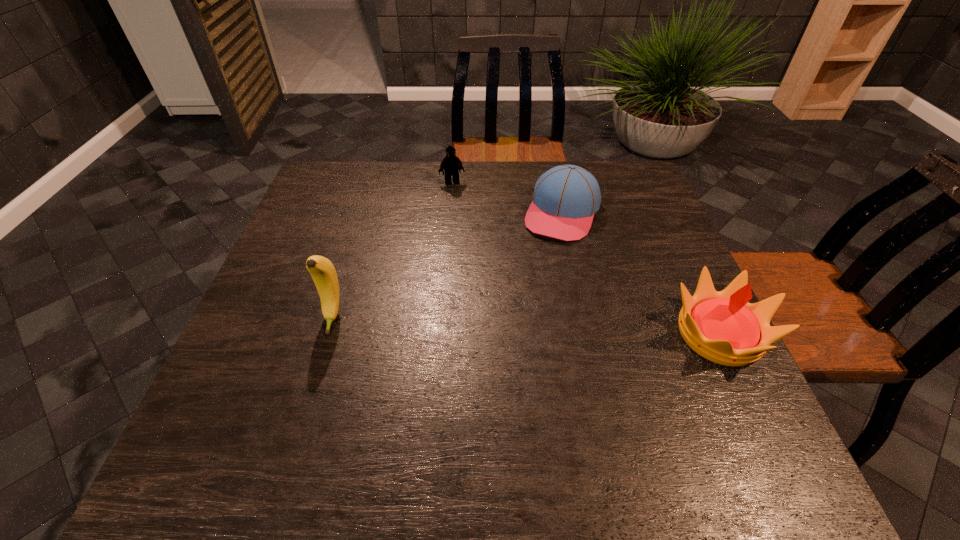
This screenshot has height=540, width=960. What are the coordinates of `free space at the left edge of the desktop` in the screenshot? It's located at (300, 267).

The height and width of the screenshot is (540, 960). Find the location of `vacant space at the right edge`. vacant space at the right edge is located at coordinates (632, 294).

In the image, there is a desktop. Where is `vacant space at the far left corner`? This screenshot has height=540, width=960. vacant space at the far left corner is located at coordinates (353, 196).

In the image, there is a desktop. Identify the location of free space at the far right corner. (649, 192).

Where is `free space between the banana and the second object from right to left`? free space between the banana and the second object from right to left is located at coordinates (447, 266).

You are a GUI agent. You are given a task and a screenshot of the screen. Output one action in this format:
    pyautogui.click(x=<x>, y=<y>)
    Task: Click on the empty location between the leftmost object and the rightmost object
    The width and height of the screenshot is (960, 540).
    Given the screenshot: What is the action you would take?
    pyautogui.click(x=526, y=326)

Identify the location of empty space that is in between the leftmost object and the rightmost object. (526, 326).

At what (x,y) coordinates should I click in order to perform the action: click on vacant area that lies between the crown and the baseball cap. Please return your answer as a coordinate pair (x, y). Looking at the image, I should click on (640, 274).

Where is `free space between the second farthest object and the farthest object`? This screenshot has width=960, height=540. free space between the second farthest object and the farthest object is located at coordinates (507, 198).

The width and height of the screenshot is (960, 540). I want to click on empty space that is in between the second object from left to right and the rightmost object, so click(586, 258).